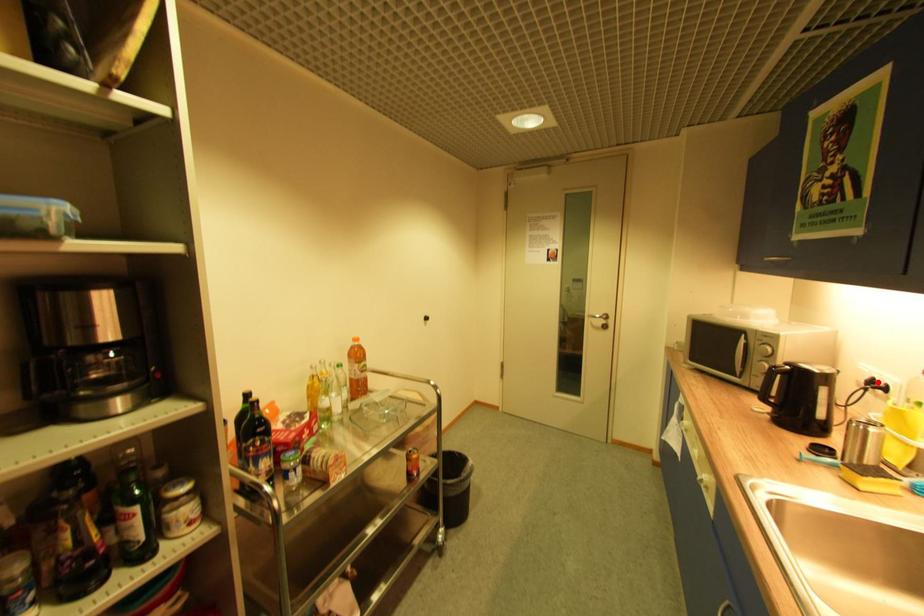
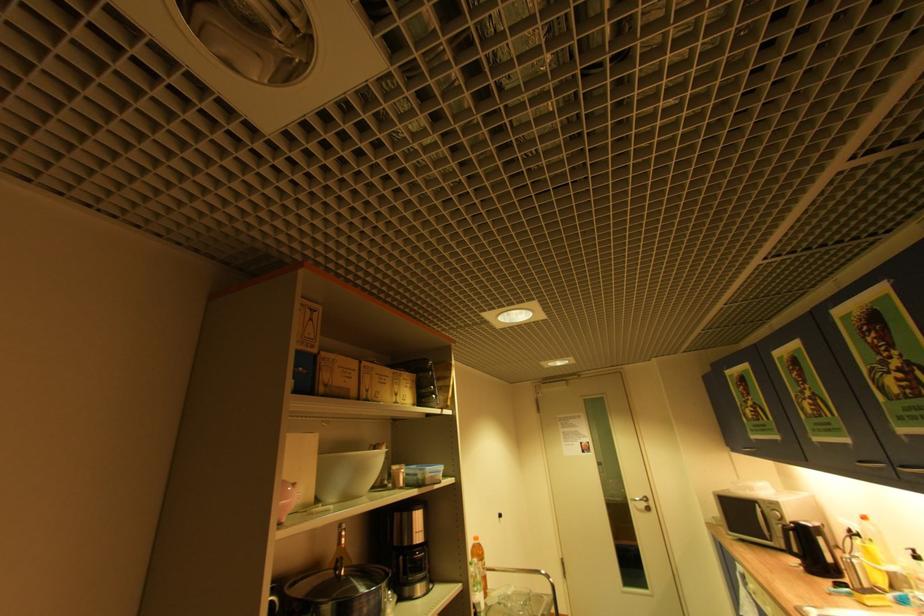
Find the pixel in the second image that matches the highlighted location in the first image.

(856, 532)